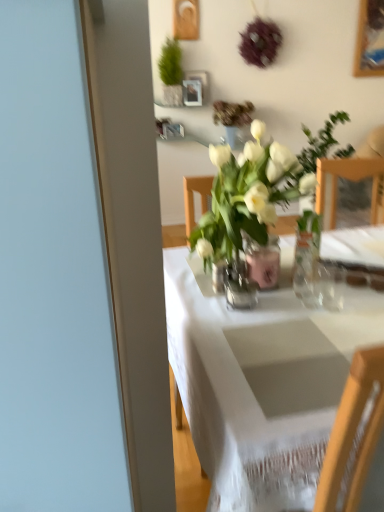
The height and width of the screenshot is (512, 384). What do you see at coordinates (245, 201) in the screenshot? I see `white glass vase at center, the 2th houseplant viewed from the back` at bounding box center [245, 201].

Where is `green matte plant at upper center, which ranks as the 2th houseplant in front-to-back order`? The image size is (384, 512). green matte plant at upper center, which ranks as the 2th houseplant in front-to-back order is located at coordinates (171, 72).

Describe the element at coordinates (261, 383) in the screenshot. Image resolution: width=384 pixels, height=512 pixels. I see `white cloth table at center` at that location.

This screenshot has width=384, height=512. I want to click on clear glass vase at center, the 2th vase viewed from the back, so click(239, 286).

How far apart are pink glass vase at center, the second vase from the front, and white glass vase at center, which ranks as the second houseplant in top-to-bottom order?

pink glass vase at center, the second vase from the front, is 4.33 inches away from white glass vase at center, which ranks as the second houseplant in top-to-bottom order.

Which point is more forward, (272, 285) or (267, 233)?

Point (267, 233)

Relative to white glass vase at center, which is the first houseplant from front to back, is pink glass vase at center, the second vase from the front, in front or behind?

pink glass vase at center, the second vase from the front, is positioned farther from the viewer than white glass vase at center, which is the first houseplant from front to back.

From a real-world perspective, is pink glass vase at center, the second vase from the front, below white glass vase at center, the 2th houseplant viewed from the back?

Yes, from a real-world perspective, pink glass vase at center, the second vase from the front, is below white glass vase at center, the 2th houseplant viewed from the back.

In the scene shown: In terms of width, does white cloth table at center look wider or thinner when compared to pink glass vase at center, the second vase from the front?

Considering their sizes, white cloth table at center looks broader than pink glass vase at center, the second vase from the front.

Which is correct: white cloth table at center is inside pink glass vase at center, the second vase from the front, or outside of it?

white cloth table at center exists outside the volume of pink glass vase at center, the second vase from the front.

Who is bigger, white cloth table at center or pink glass vase at center, which appears as the 1th vase when viewed from the back?

white cloth table at center is bigger.

Find the location of a particular element. The width and height of the screenshot is (384, 512). table in front of the pink glass vase at center, the second vase from the front is located at coordinates (261, 383).

Does clear glass vase at center, acting as the first vase starting from the front, have a lesser height compared to white glass vase at center, which is the second houseplant in left-to-right order?

Correct, clear glass vase at center, acting as the first vase starting from the front, is not as tall as white glass vase at center, which is the second houseplant in left-to-right order.

From the image's perspective, between clear glass vase at center, acting as the first vase starting from the front, and white glass vase at center, which is the second houseplant in left-to-right order, who is located below?

From the image's view, clear glass vase at center, acting as the first vase starting from the front, is below.

Considering their positions, is clear glass vase at center, acting as the first vase starting from the front, located in front of or behind white glass vase at center, which is counted as the first houseplant, starting from the right?

Clearly, clear glass vase at center, acting as the first vase starting from the front, is behind white glass vase at center, which is counted as the first houseplant, starting from the right.

Is clear glass vase at center, acting as the first vase starting from the front, wider than white glass vase at center, which ranks as the second houseplant in top-to-bottom order?

In fact, clear glass vase at center, acting as the first vase starting from the front, might be narrower than white glass vase at center, which ranks as the second houseplant in top-to-bottom order.

Is point (193, 284) closer or farther from the camera than point (298, 173)?

Point (193, 284) is positioned farther from the camera compared to point (298, 173).

Looking at this image, from the image's perspective, which one is positioned higher, white cloth table at center or white glass vase at center, which ranks as the second houseplant in top-to-bottom order?

white glass vase at center, which ranks as the second houseplant in top-to-bottom order, is shown above in the image.

From a real-world perspective, starting from the white cloth table at center, which houseplant is the 1st one vertically above it? Please provide its 2D coordinates.

[(245, 201)]

Can you confirm if white glass vase at center, the 2th houseplant viewed from the back, is shorter than pink glass vase at center, the second vase from the front?

In fact, white glass vase at center, the 2th houseplant viewed from the back, may be taller than pink glass vase at center, the second vase from the front.

Is pink glass vase at center, the second vase from the front, at the back of white glass vase at center, which is counted as the first houseplant, starting from the right?

That's not correct — white glass vase at center, which is counted as the first houseplant, starting from the right, is not looking away from pink glass vase at center, the second vase from the front.

How different are the orientations of white glass vase at center, placed as the 1th houseplant when sorted from bottom to top, and pink glass vase at center, the second vase from the front, in degrees?

93.6 degrees.

Is white glass vase at center, the 2th houseplant viewed from the back, to the left or to the right of pink glass vase at center, the second vase from the front, in the image?

From the image, it's evident that white glass vase at center, the 2th houseplant viewed from the back, is to the left of pink glass vase at center, the second vase from the front.

From a real-world perspective, which is physically above, white glass vase at center, which is counted as the first houseplant, starting from the right, or white cloth table at center?

From a 3D spatial view, white glass vase at center, which is counted as the first houseplant, starting from the right, is above.

Who is bigger, white glass vase at center, placed as the 1th houseplant when sorted from bottom to top, or white cloth table at center?

With larger size is white cloth table at center.

Is point (275, 158) positioned in front of point (224, 451)?

That is False.

Is white glass vase at center, which is the second houseplant in left-to-right order, oriented away from white cloth table at center?

No, white glass vase at center, which is the second houseplant in left-to-right order, is not facing the opposite direction of white cloth table at center.

Considering the positions of points (286, 448) and (174, 60), is point (286, 448) farther from camera compared to point (174, 60)?

No, (286, 448) is closer to viewer.

From a real-world perspective, is white cloth table at center physically located above or below green matte plant at upper center, which is the first houseplant from back to front?

From a real-world perspective, white cloth table at center is physically below green matte plant at upper center, which is the first houseplant from back to front.

Can you confirm if white cloth table at center is positioned to the right of green matte plant at upper center, which ranks as the 2th houseplant in front-to-back order?

Yes, white cloth table at center is to the right of green matte plant at upper center, which ranks as the 2th houseplant in front-to-back order.

Starting from the pink glass vase at center, which appears as the 1th vase when viewed from the back, which houseplant is the 1st one to the left? Please provide its 2D coordinates.

[(245, 201)]

Where is `the 2nd vase directly above the white cloth table at center (from a real-world perspective)`? This screenshot has height=512, width=384. the 2nd vase directly above the white cloth table at center (from a real-world perspective) is located at coordinates (262, 261).

Considering their positions, is white cloth table at center positioned further to green matte plant at upper center, which ranks as the 2th houseplant in front-to-back order, than white glass vase at center, which ranks as the second houseplant in top-to-bottom order?

Among the two, white cloth table at center is located further to green matte plant at upper center, which ranks as the 2th houseplant in front-to-back order.

Looking at the image, which one is located closer to white glass vase at center, which is the first houseplant from front to back, pink glass vase at center, which appears as the 1th vase when viewed from the back, or white cloth table at center?

pink glass vase at center, which appears as the 1th vase when viewed from the back, lies closer to white glass vase at center, which is the first houseplant from front to back, than the other object.

From the image, which object appears to be nearer to white cloth table at center, clear glass vase at center, the 2th vase viewed from the back, or pink glass vase at center, the second vase from the front?

Among the two, clear glass vase at center, the 2th vase viewed from the back, is located nearer to white cloth table at center.

From the image, which object appears to be farther from green matte plant at upper center, which is the 2th houseplant in right-to-left order, white cloth table at center or clear glass vase at center, acting as the first vase starting from the front?

white cloth table at center is positioned further to the anchor green matte plant at upper center, which is the 2th houseplant in right-to-left order.

Looking at the image, which one is located closer to green matte plant at upper center, acting as the 2th houseplant starting from the bottom, pink glass vase at center, the second vase from the front, or white glass vase at center, which is counted as the first houseplant, starting from the right?

pink glass vase at center, the second vase from the front, lies closer to green matte plant at upper center, acting as the 2th houseplant starting from the bottom, than the other object.

When comparing their distances from clear glass vase at center, the 2th vase viewed from the back, does green matte plant at upper center, which is the 2th houseplant in right-to-left order, or pink glass vase at center, which appears as the 1th vase when viewed from the back, seem further?

Based on the image, green matte plant at upper center, which is the 2th houseplant in right-to-left order, appears to be further to clear glass vase at center, the 2th vase viewed from the back.

When comparing their distances from pink glass vase at center, which appears as the 1th vase when viewed from the back, does clear glass vase at center, the 2th vase viewed from the back, or white cloth table at center seem closer?

clear glass vase at center, the 2th vase viewed from the back.

Estimate the real-world distances between objects in this image. Which object is closer to pink glass vase at center, which appears as the 1th vase when viewed from the back, white cloth table at center or white glass vase at center, the 2th houseplant viewed from the back?

Based on the image, white glass vase at center, the 2th houseplant viewed from the back, appears to be nearer to pink glass vase at center, which appears as the 1th vase when viewed from the back.

Locate an element on the screen. vase positioned between white cloth table at center and pink glass vase at center, the second vase from the front, from near to far is located at coordinates (239, 286).

Where is `houseplant between white cloth table at center and green matte plant at upper center, acting as the 2th houseplant starting from the bottom, from front to back`? Image resolution: width=384 pixels, height=512 pixels. houseplant between white cloth table at center and green matte plant at upper center, acting as the 2th houseplant starting from the bottom, from front to back is located at coordinates (245, 201).

This screenshot has height=512, width=384. I want to click on vase between white glass vase at center, placed as the 1th houseplant when sorted from bottom to top, and clear glass vase at center, the 2th vase viewed from the back, in the vertical direction, so click(x=262, y=261).

You are a GUI agent. You are given a task and a screenshot of the screen. Output one action in this format:
    pyautogui.click(x=<x>, y=<y>)
    Task: Click on the vase between clear glass vase at center, acting as the first vase starting from the front, and green matte plant at upper center, which ranks as the 2th houseplant in front-to-back order, from front to back
    This screenshot has width=384, height=512.
    Given the screenshot: What is the action you would take?
    pyautogui.click(x=262, y=261)